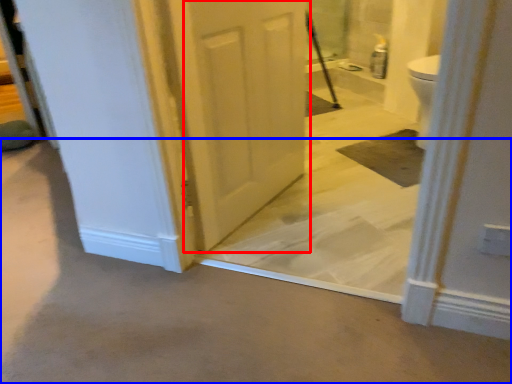
Question: Which of the following is the closest to the observer, door (highlighted by a red box) or concrete (highlighted by a blue box)?

Choices:
 (A) door
 (B) concrete

Answer: (B)